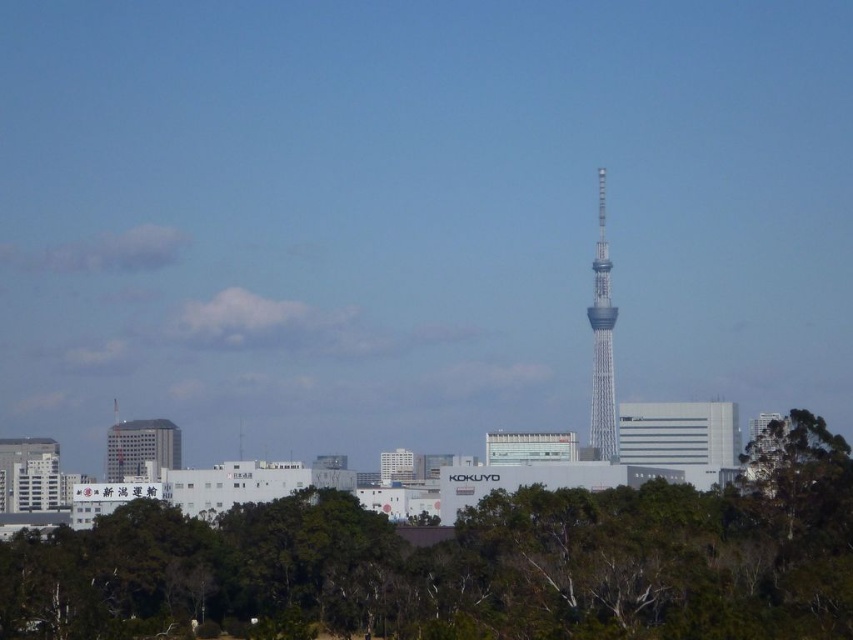
Question: Can you confirm if green leafy trees at lower center is positioned to the left of matte gray building at center-left?

Choices:
 (A) yes
 (B) no

Answer: (B)

Question: Which of the following is the closest to the observer?

Choices:
 (A) click(782, 461)
 (B) click(141, 420)
 (C) click(596, 316)

Answer: (C)

Question: Which is nearer to the matte gray building at center-left?

Choices:
 (A) green leafy trees at lower center
 (B) white glass tower at center

Answer: (A)

Question: Does white glass tower at center appear on the right side of matte gray building at center-left?

Choices:
 (A) no
 (B) yes

Answer: (B)

Question: Can you confirm if white glass tower at center is positioned below matte gray building at center-left?

Choices:
 (A) yes
 (B) no

Answer: (B)

Question: Which point appears farthest from the camera in this image?

Choices:
 (A) (601, 449)
 (B) (421, 595)
 (C) (151, 440)

Answer: (C)